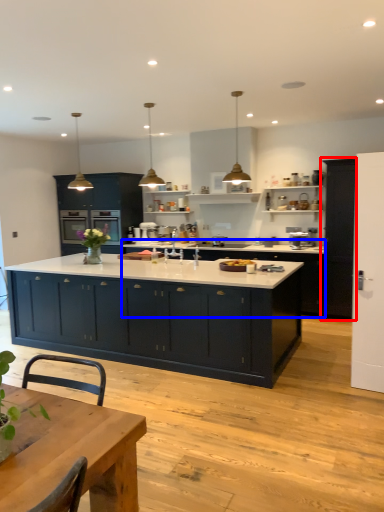
Question: Which object is closer to the camera taking this photo, cabinetry (highlighted by a red box) or cabinetry (highlighted by a blue box)?

Choices:
 (A) cabinetry
 (B) cabinetry

Answer: (A)